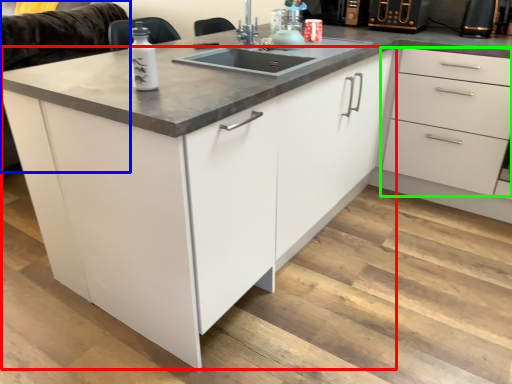
Question: Which object is the closest to the cabinetry (highlighted by a red box)? Choose among these: couch (highlighted by a blue box) or drawer (highlighted by a green box).

Choices:
 (A) couch
 (B) drawer

Answer: (B)